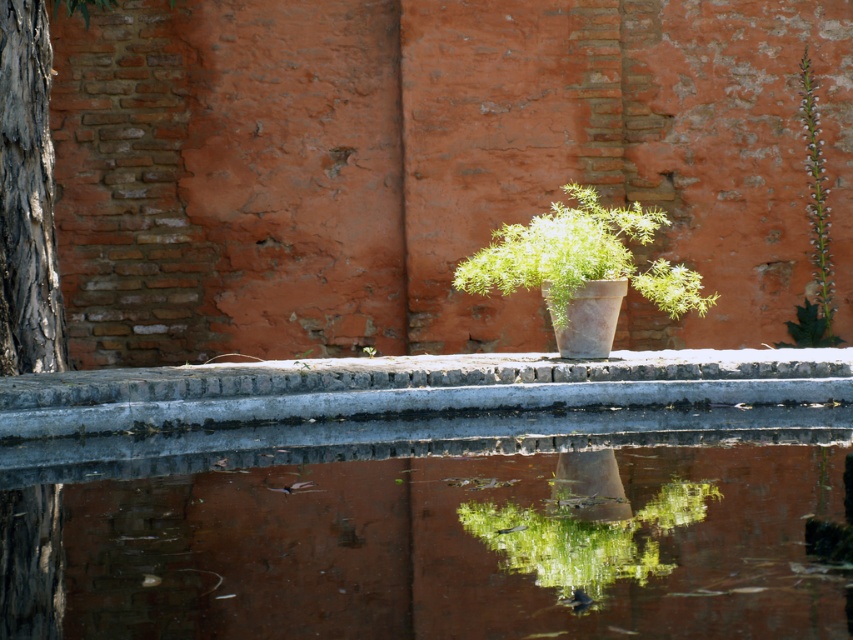
You are designing a garden layout and need to place a small bench between the gray bark tree trunk at left and the green algae at center. Which side of the bench should face the narrower object to ensure proper spacing?

The gray bark tree trunk at left is narrower than the green algae at center. Therefore, the bench should face the gray bark tree trunk at left to maintain appropriate spacing between the two objects.

You are standing in the outdoor scene and want to water the green matte plant at center. The smooth concrete water at center is nearby. Which direction should you move to reach the water first before watering the plant?

The smooth concrete water at center is positioned on the left side of green matte plant at center, so you should move to your left to reach the water first before watering the plant.

You are designing a small garden and want to place a decorative item next to the green matte plant at center. Considering the size of the smooth concrete water at center, what should you avoid placing near the plant to prevent overcrowding?

The smooth concrete water at center is larger than the green matte plant at center. To prevent overcrowding, avoid placing items that are as large or larger than the smooth concrete water at center near the plant.